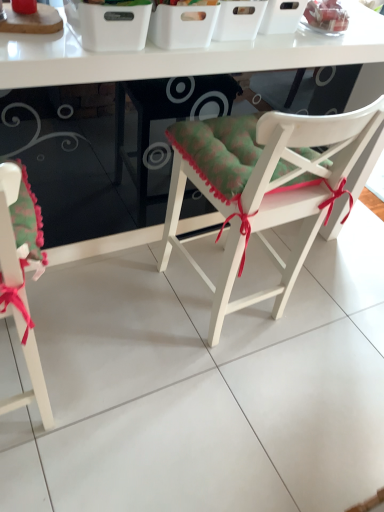
The width and height of the screenshot is (384, 512). Identify the location of unoccupied region to the right of white wood chair at center, arranged as the second chair when viewed from the left. pos(321,331).